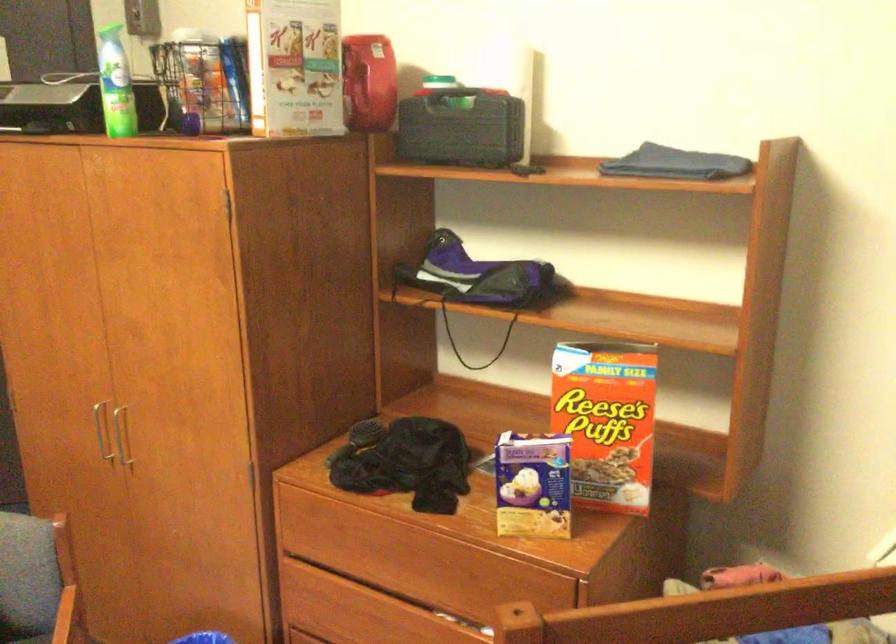
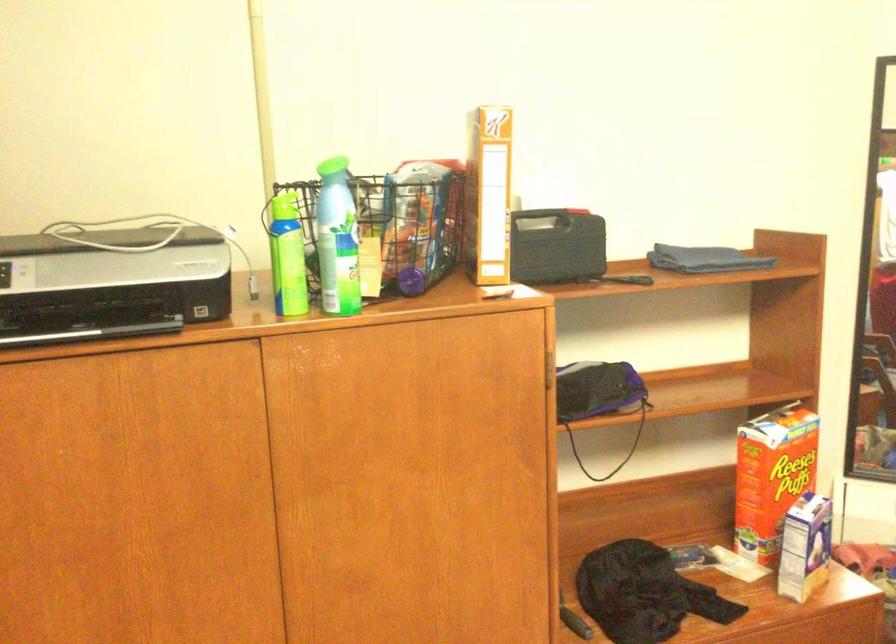
The point at (401, 469) is marked in the first image. Where is the corresponding point in the second image?

(643, 592)